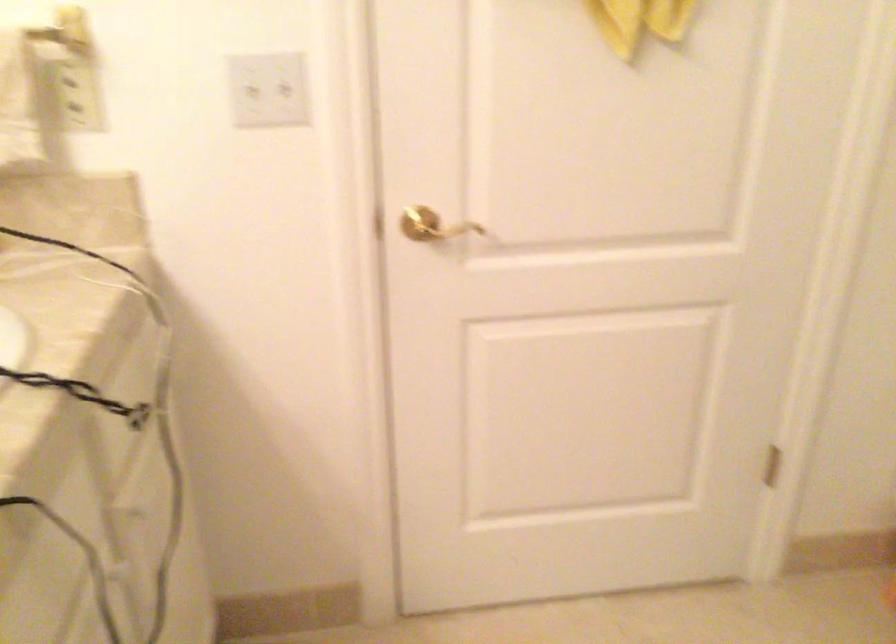
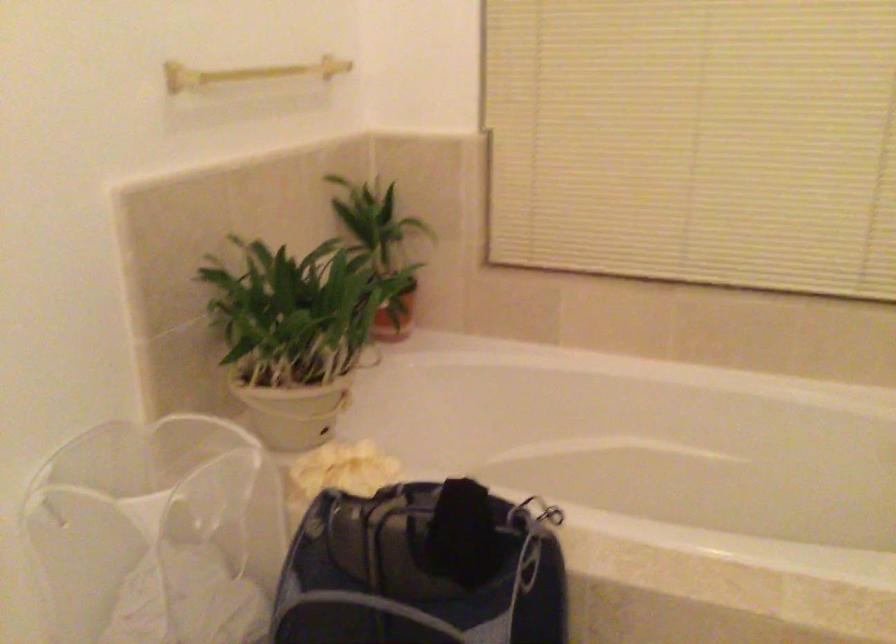
Question: The camera is either moving clockwise (left) or counter-clockwise (right) around the object. The first image is from the beginning of the video and the second image is from the end. Is the camera moving left or right when shooting the video?

Choices:
 (A) Left
 (B) Right

Answer: (A)